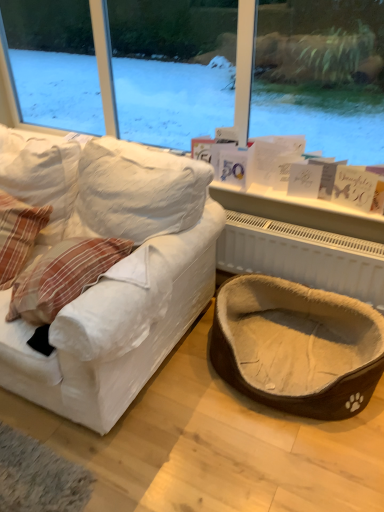
Question: From the image's perspective, relative to white textured radiator at lower right, is white fabric couch at left above or below?

Choices:
 (A) below
 (B) above

Answer: (B)

Question: Considering the positions of point (183, 159) and point (243, 231), is point (183, 159) closer or farther from the camera than point (243, 231)?

Choices:
 (A) closer
 (B) farther

Answer: (A)

Question: Which object is positioned closest to the white textured radiator at lower right?

Choices:
 (A) white fabric couch at left
 (B) plaid fabric pillow at left
 (C) brown fuzzy pet bed at lower right

Answer: (C)

Question: Which of these objects is positioned farthest from the brown fuzzy pet bed at lower right?

Choices:
 (A) white fabric couch at left
 (B) white textured radiator at lower right
 (C) plaid fabric pillow at left

Answer: (C)